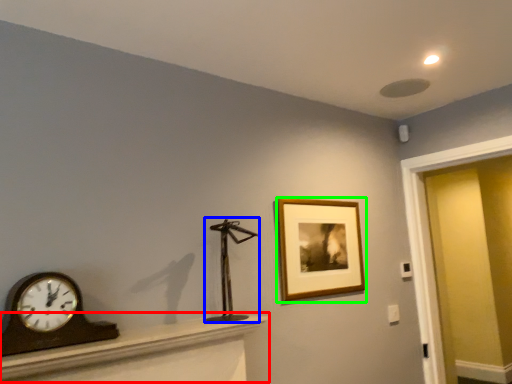
Question: Estimate the real-world distances between objects in this image. Which object is closer to furniture (highlighted by a red box), sculpture (highlighted by a blue box) or picture frame (highlighted by a green box)?

Choices:
 (A) sculpture
 (B) picture frame

Answer: (A)